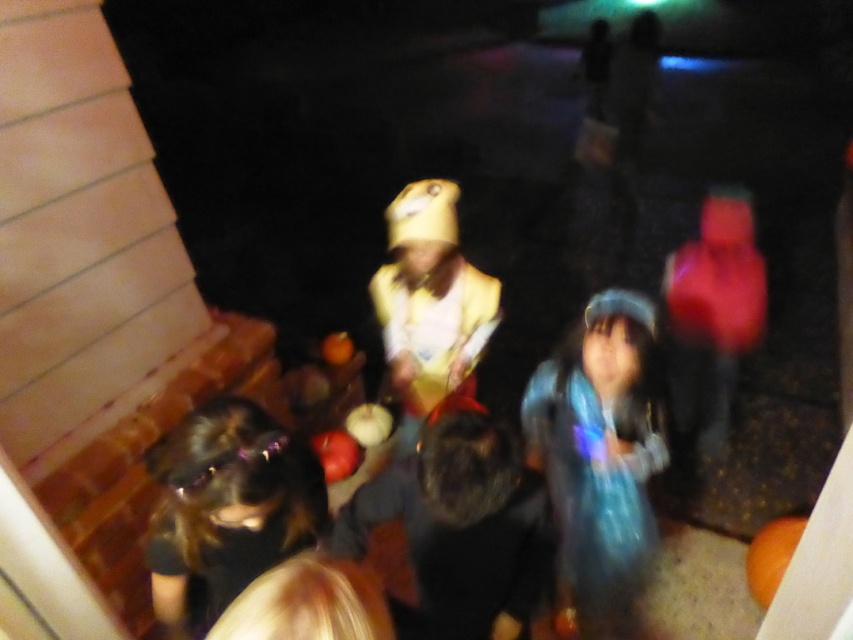
You are a photographer trying to capture a clear shot of the black shiny hair at lower left and the yellow matte costume at center in this blurry Halloween scene. Since the image is too blurry, you decide to adjust your camera settings. Which object should you focus on first to ensure it appears clearer in the next photo?

The yellow matte costume at center should be focused on first because it occupies more space than the black shiny hair at lower left, making it a priority for clarity.

You are a photographer trying to capture a clear shot of the black furry dog at center and the black shiny hair at lower left. Given the scene is dark, which object should you focus on first to ensure it appears sharp, considering their sizes?

The black furry dog at center is wider than the black shiny hair at lower left, so you should focus on the black furry dog at center first to ensure it appears sharp in the dark scene.

In the scene shown: You are standing at the point with coordinates (599,452) in the image. What object is exactly at this point?

The translucent blue dress at center is located at point (599,452).